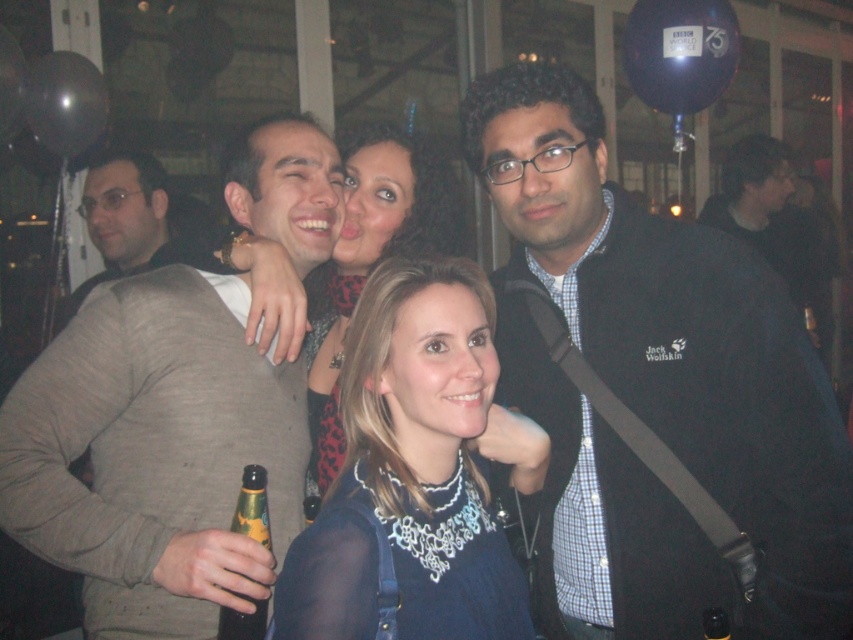
You are standing in the middle of the room and want to move towards both the point at coordinates [756,444] and the point at coordinates [409,392]. Which point will you reach first?

You will reach point [756,444] first because it is closer to you than point [409,392], which is further away.

You are standing in the middle of the room and want to move towards both the point at coordinates point (x=344, y=563) and point (x=259, y=616). Which point will you reach first?

You will reach point (x=344, y=563) first because it is closer to you than point (x=259, y=616).